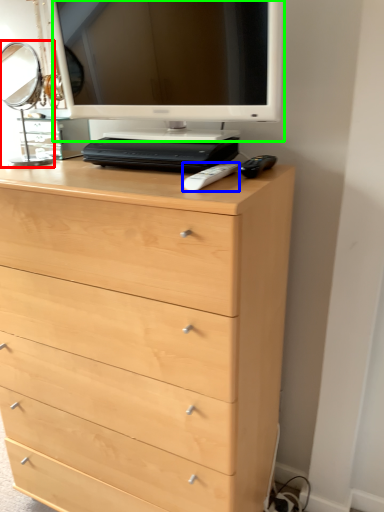
Question: Considering the real-world distances, which object is farthest from table lamp (highlighted by a red box)? remote (highlighted by a blue box) or computer monitor (highlighted by a green box)?

Choices:
 (A) remote
 (B) computer monitor

Answer: (A)